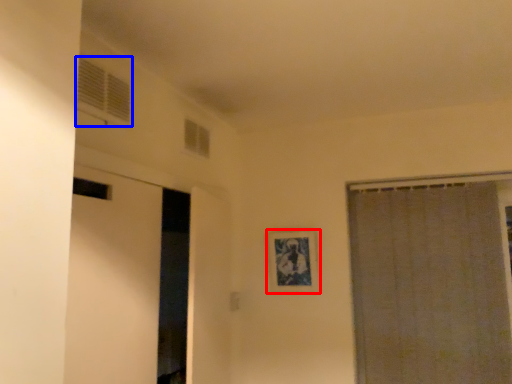
Question: Among these objects, which one is farthest to the camera, picture frame (highlighted by a red box) or window (highlighted by a blue box)?

Choices:
 (A) picture frame
 (B) window

Answer: (A)